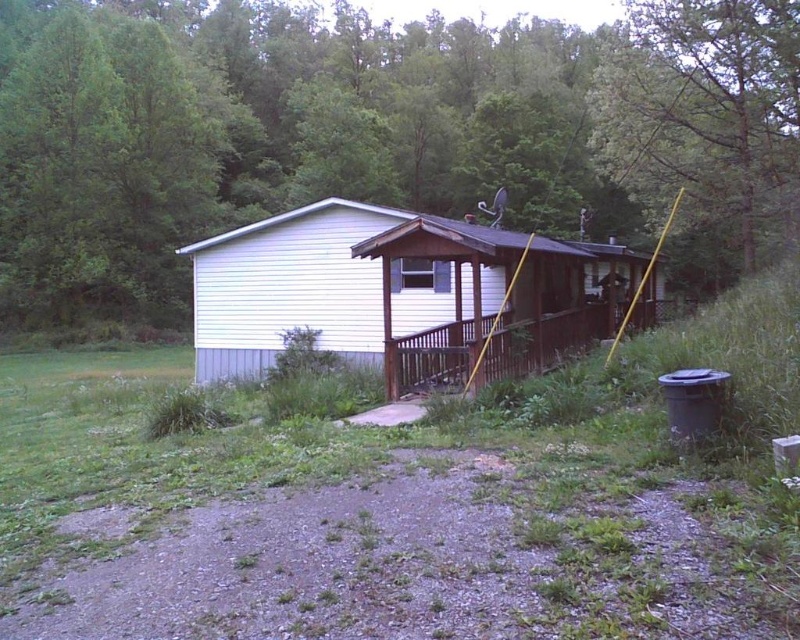
Between green leafy tree at upper center and white siding cabin at center, which one is positioned higher?

green leafy tree at upper center is above.

Find the location of a particular element. green leafy tree at upper center is located at coordinates (377, 132).

Between green leafy tree at upper center and green leafy tree at upper right, which one appears on the right side from the viewer's perspective?

green leafy tree at upper right

Does point (82, 138) come closer to viewer compared to point (750, 227)?

No, it is not.

Is point (92, 58) positioned after point (626, 36)?

Yes, point (92, 58) is behind point (626, 36).

The image size is (800, 640). What are the coordinates of `green leafy tree at upper center` in the screenshot? It's located at (377, 132).

How much distance is there between white siding cabin at center and green leafy tree at upper right?

7.61 meters

Can you confirm if white siding cabin at center is wider than green leafy tree at upper right?

Correct, the width of white siding cabin at center exceeds that of green leafy tree at upper right.

What do you see at coordinates (401, 292) in the screenshot? The width and height of the screenshot is (800, 640). I see `white siding cabin at center` at bounding box center [401, 292].

The height and width of the screenshot is (640, 800). I want to click on white siding cabin at center, so click(x=401, y=292).